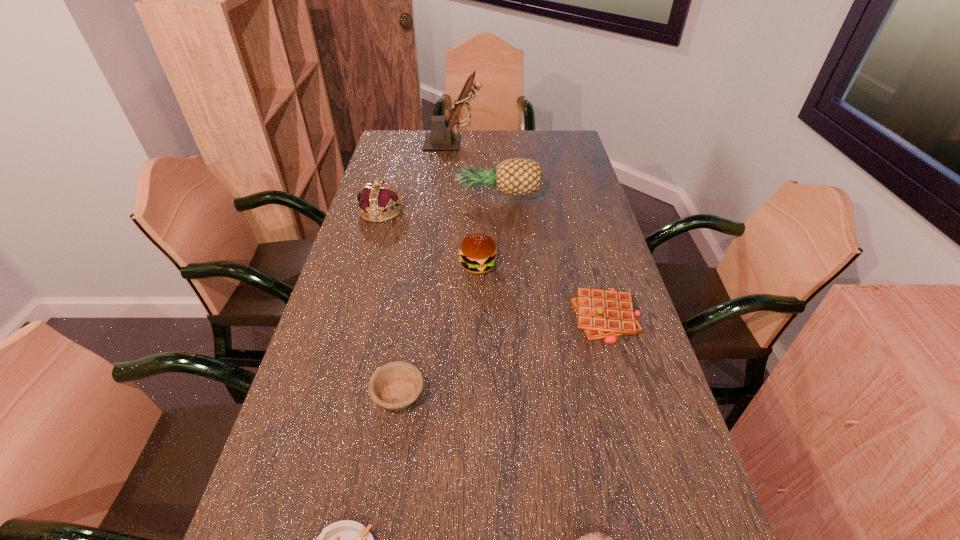
Image resolution: width=960 pixels, height=540 pixels. I want to click on free space at the right edge, so click(664, 397).

The image size is (960, 540). In order to click on free space between the bowl and the hamburger in this screenshot , I will do `click(439, 329)`.

In order to click on free area in between the sixth farthest object and the crown in this screenshot , I will do `click(390, 302)`.

Where is `unoccupied position between the bowl and the crown`? This screenshot has height=540, width=960. unoccupied position between the bowl and the crown is located at coordinates (390, 302).

Locate an element on the screen. This screenshot has height=540, width=960. free space between the figurine and the rightmost object is located at coordinates coord(530,230).

This screenshot has height=540, width=960. I want to click on unoccupied position between the waffle and the sixth farthest object, so 502,355.

Locate an element on the screen. The height and width of the screenshot is (540, 960). vacant space that's between the rightmost object and the fifth shortest object is located at coordinates (542, 292).

I want to click on vacant area that lies between the farthest object and the hamburger, so click(x=466, y=204).

This screenshot has height=540, width=960. I want to click on object that can be found as the closest to the doughnut, so click(346, 539).

Identify which object is the seventh closest to the bowl. Please provide its 2D coordinates. Your answer should be formatted as a tuple, i.e. [(x, y)], where the tuple contains the x and y coordinates of a point satisfying the conditions above.

[(441, 138)]